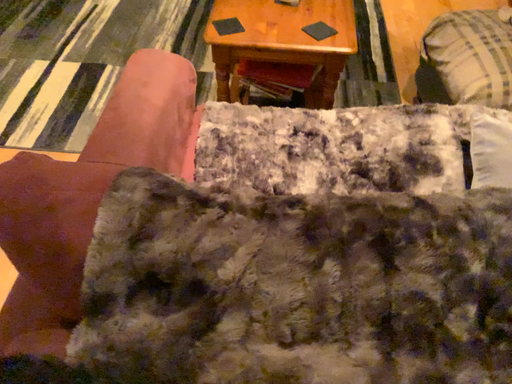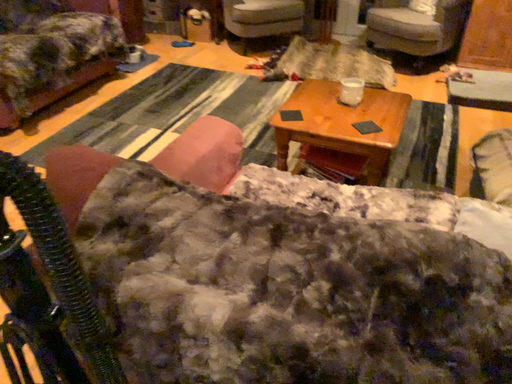
Question: How did the camera likely rotate when shooting the video?

Choices:
 (A) rotated upward
 (B) rotated downward

Answer: (A)